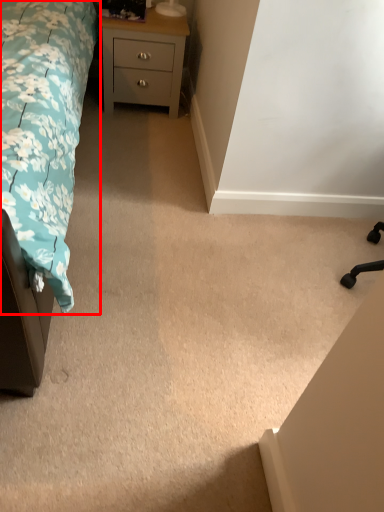
Question: From the image, what is the correct spatial relationship of bed (annotated by the red box) in relation to chest of drawers?

Choices:
 (A) left
 (B) right

Answer: (A)